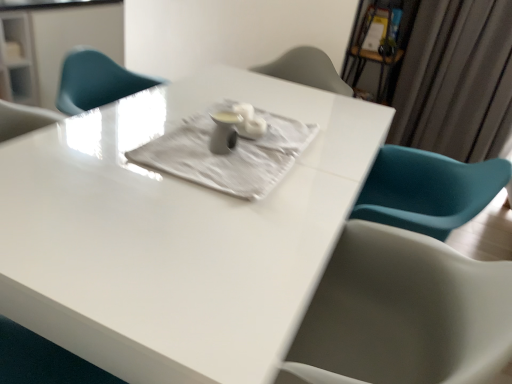
Locate an element on the screen. The width and height of the screenshot is (512, 384). vacant area on the back side of white textured cloth at center is located at coordinates (266, 97).